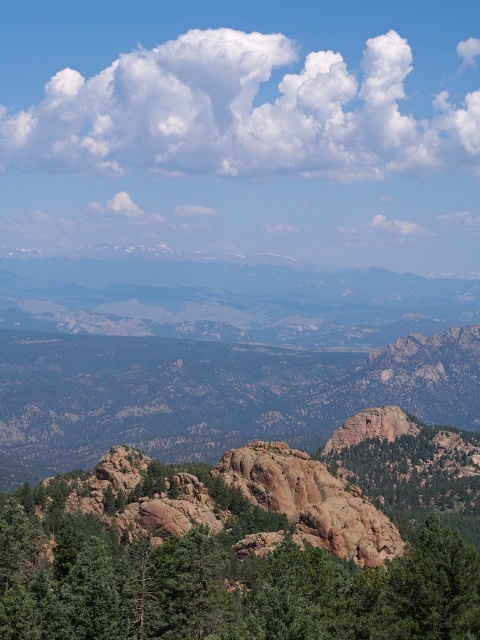
Which of these two, white fluffy cloud at upper center or green textured rock at center, stands shorter?

green textured rock at center is shorter.

Measure the distance between white fluffy cloud at upper center and green textured rock at center.

white fluffy cloud at upper center is 581.68 meters from green textured rock at center.

Is point (202, 60) closer to viewer compared to point (417, 536)?

No, it is not.

Find the location of `white fluffy cloud at upper center`. white fluffy cloud at upper center is located at coordinates (240, 113).

Who is shorter, green textured rock at center or rocky mountain range at center?

green textured rock at center is shorter.

Does green textured rock at center have a larger size compared to rocky mountain range at center?

Actually, green textured rock at center might be smaller than rocky mountain range at center.

Between point (462, 616) and point (297, 285), which one is positioned behind?

The point (297, 285) is behind.

Locate an element on the screen. The width and height of the screenshot is (480, 640). green textured rock at center is located at coordinates (224, 586).

Which is more to the right, white fluffy cloud at upper center or rocky mountain range at center?

white fluffy cloud at upper center

In the scene shown: Between white fluffy cloud at upper center and rocky mountain range at center, which one has more height?

white fluffy cloud at upper center

Is point (169, 56) farther from camera compared to point (457, 314)?

Yes, point (169, 56) is farther from viewer.

Locate an element on the screen. The height and width of the screenshot is (640, 480). white fluffy cloud at upper center is located at coordinates (240, 113).